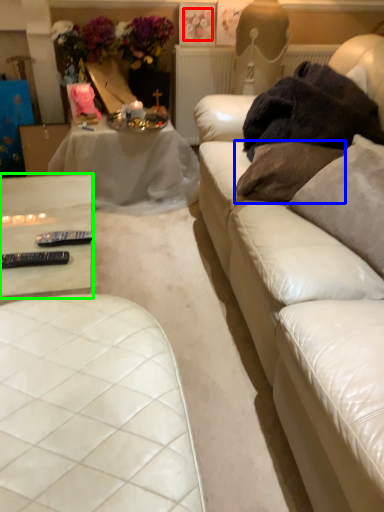
Question: Estimate the real-world distances between objects in this image. Which object is farther from flower (highlighted by a red box), pillow (highlighted by a blue box) or table (highlighted by a green box)?

Choices:
 (A) pillow
 (B) table

Answer: (B)